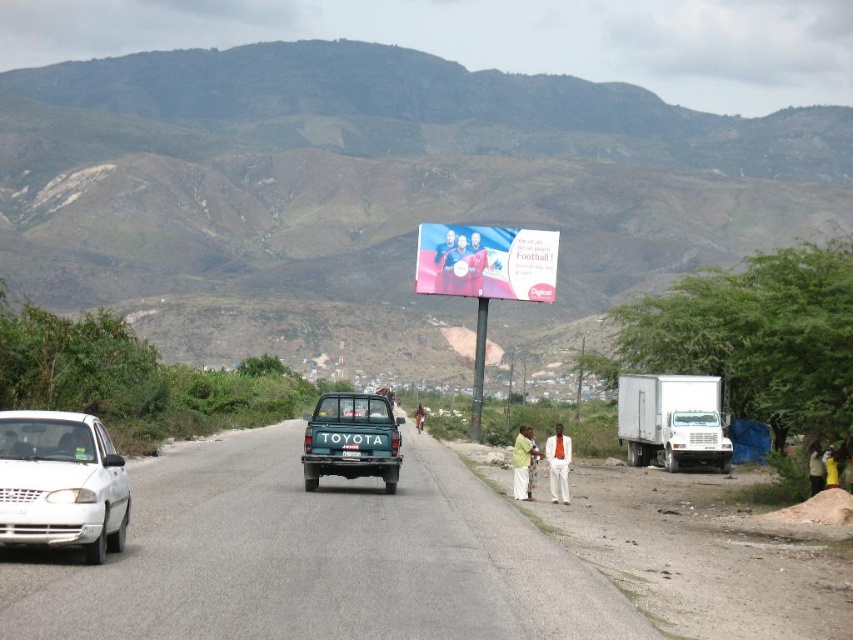
Between green matte toyota truck at center and blue fabric billboard at center, which one is positioned higher?

blue fabric billboard at center is higher up.

Is green matte toyota truck at center smaller than blue fabric billboard at center?

No, green matte toyota truck at center is not smaller than blue fabric billboard at center.

The height and width of the screenshot is (640, 853). Find the location of `green matte toyota truck at center`. green matte toyota truck at center is located at coordinates (351, 438).

Which is behind, point (450, 288) or point (813, 493)?

Positioned behind is point (450, 288).

Is point (445, 285) behind point (817, 483)?

Yes, point (445, 285) is farther from viewer.

This screenshot has width=853, height=640. Find the location of `smooth leather jacket at center`. smooth leather jacket at center is located at coordinates (444, 262).

Between point (648, 445) and point (349, 449), which one is positioned behind?

The point (648, 445) is more distant.

Between point (683, 378) and point (357, 449), which one is positioned in front?

Point (357, 449)

Between point (645, 416) and point (346, 445), which one is positioned in front?

Point (346, 445) is more forward.

Find the location of a particular element. This screenshot has width=853, height=640. white matte truck at right is located at coordinates (672, 420).